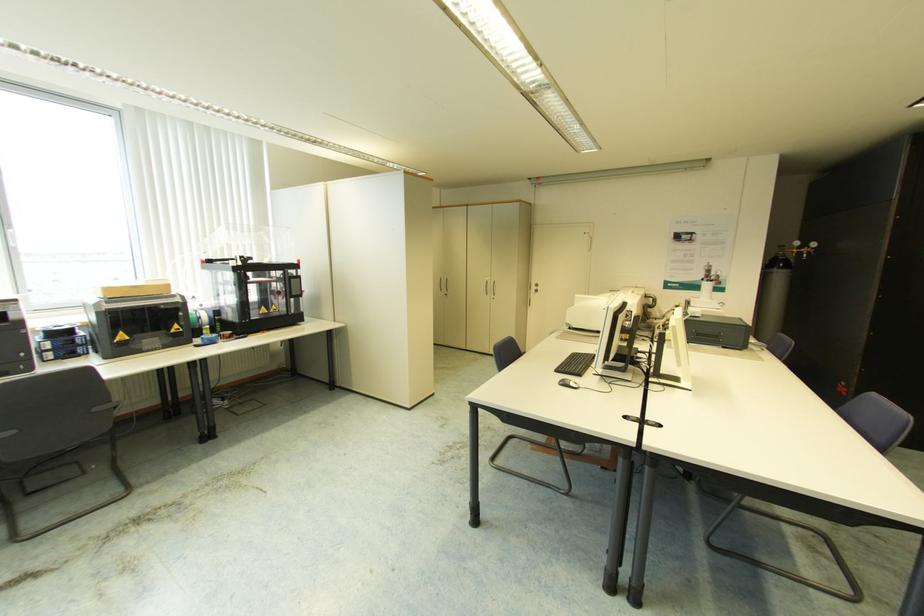
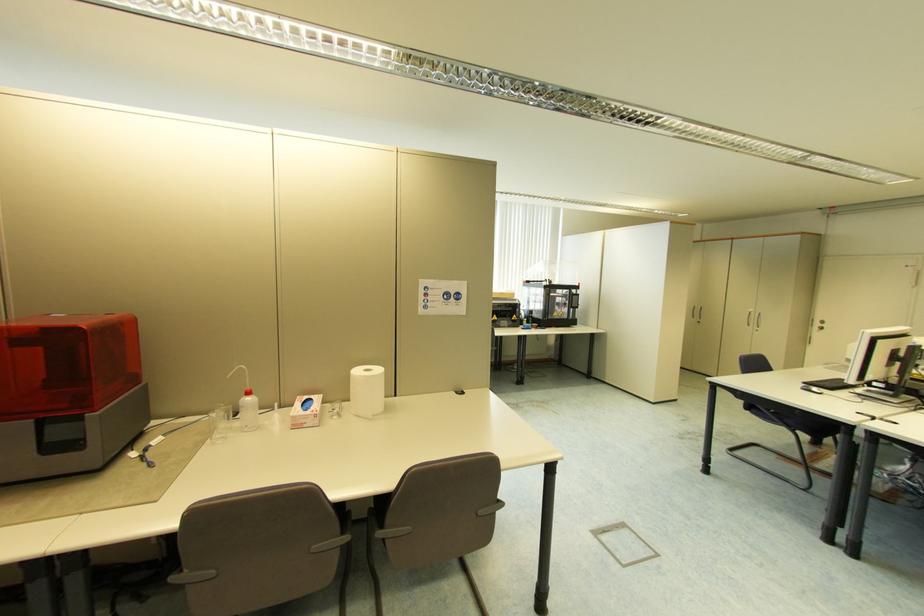
Locate, in the second image, the point that corresponds to point (537, 288) in the first image.

(821, 325)